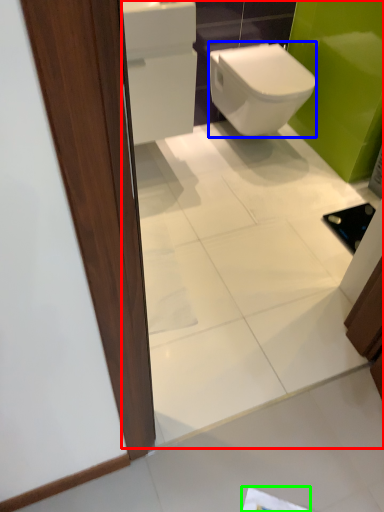
Question: Based on their relative distances, which object is farther from mirror (highlighted by a red box)? Choose from bidet (highlighted by a blue box) and paper (highlighted by a green box).

Choices:
 (A) bidet
 (B) paper

Answer: (B)